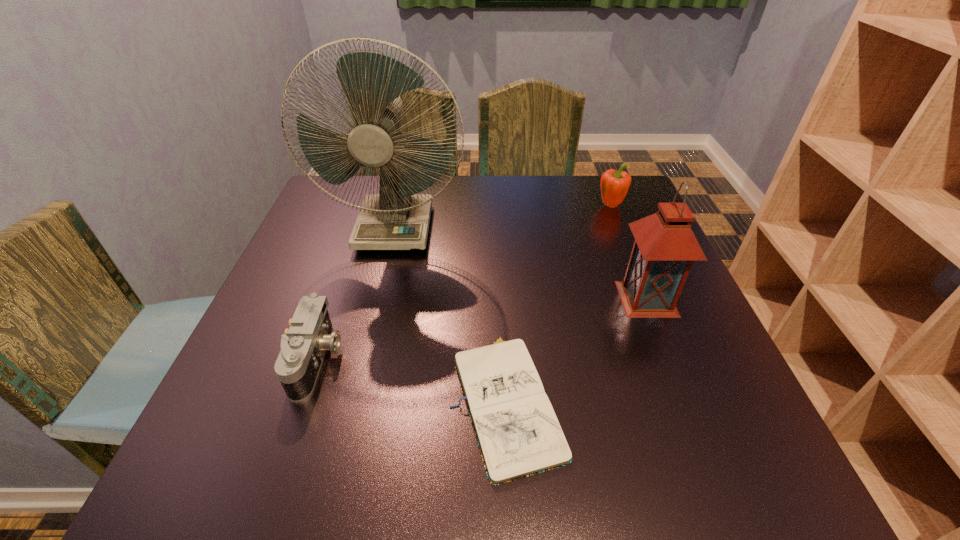
At what (x,y) coordinates should I click in order to perform the action: click on vacant space at the far edge of the desktop. Please return your answer as a coordinate pair (x, y). This screenshot has height=540, width=960. Looking at the image, I should click on (569, 218).

At what (x,y) coordinates should I click in order to perform the action: click on blank space at the near edge of the desktop. Please return your answer as a coordinate pair (x, y). The width and height of the screenshot is (960, 540). Looking at the image, I should click on (608, 471).

Locate an element on the screen. This screenshot has height=540, width=960. vacant space at the left edge is located at coordinates (244, 432).

Image resolution: width=960 pixels, height=540 pixels. In order to click on vacant space at the right edge in this screenshot , I will do `click(691, 349)`.

This screenshot has width=960, height=540. Identify the location of free location at the far right corner of the desktop. (578, 179).

This screenshot has height=540, width=960. I want to click on empty location between the third tallest object and the fourth tallest object, so click(x=464, y=282).

You are a GUI agent. You are given a task and a screenshot of the screen. Output one action in this format:
    pyautogui.click(x=<x>, y=<y>)
    Task: Click on the vacant space that's between the notebook and the camera
    The width and height of the screenshot is (960, 540).
    Given the screenshot: What is the action you would take?
    pyautogui.click(x=412, y=379)

This screenshot has height=540, width=960. I want to click on free spot between the fan and the pepper, so click(x=503, y=217).

Identify the location of free space between the tallest object and the third shortest object. This screenshot has width=960, height=540. (503, 217).

What are the coordinates of `empty space between the camera and the third tallest object` in the screenshot? It's located at (464, 282).